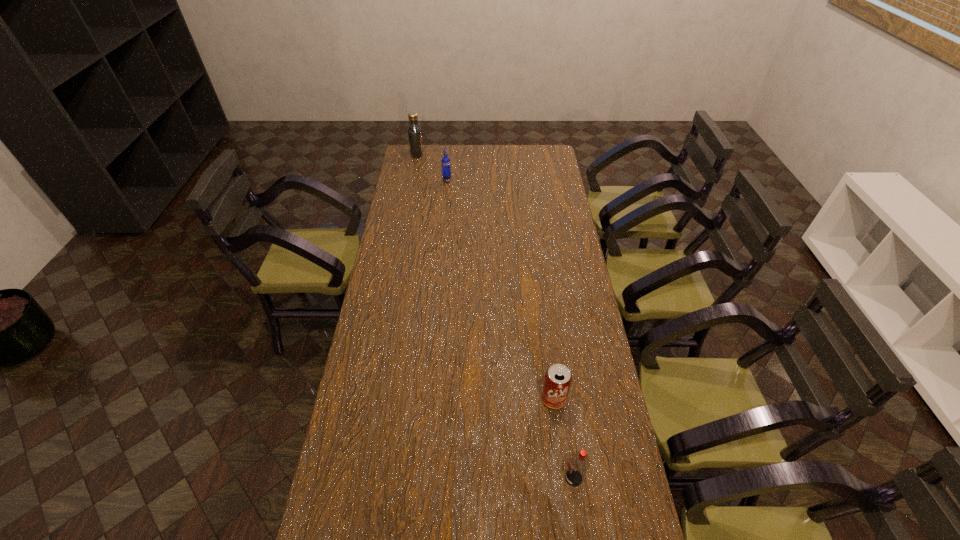
Where is `vacant position located on the front label of the rightmost vodka`? This screenshot has height=540, width=960. vacant position located on the front label of the rightmost vodka is located at coordinates (451, 478).

The image size is (960, 540). In order to click on free spot located 0.170m on the front label of the rightmost vodka in this screenshot , I will do `click(504, 478)`.

This screenshot has height=540, width=960. I want to click on vacant region located 0.350m on the front of the soda can, so click(571, 536).

At what (x,y) coordinates should I click in order to perform the action: click on object positioned at the far edge. Please return your answer as a coordinate pair (x, y). The image size is (960, 540). Looking at the image, I should click on (414, 131).

Locate an element on the screen. The width and height of the screenshot is (960, 540). object at the left edge is located at coordinates (414, 131).

Locate an element on the screen. This screenshot has height=540, width=960. vodka situated at the right edge is located at coordinates (579, 463).

You are a GUI agent. You are given a task and a screenshot of the screen. Output one action in this format:
    pyautogui.click(x=<x>, y=<y>)
    Task: Click on the soda can that is at the right edge
    This screenshot has height=540, width=960.
    Given the screenshot: What is the action you would take?
    pyautogui.click(x=557, y=381)

Identify the location of object positioned at the far left corner. This screenshot has width=960, height=540. (414, 131).

Where is `vacant space at the far edge`? vacant space at the far edge is located at coordinates (445, 147).

At what (x,y) coordinates should I click in order to perform the action: click on vacant region at the left edge of the desktop. Please return your answer as a coordinate pair (x, y). Image resolution: width=960 pixels, height=540 pixels. Looking at the image, I should click on (389, 390).